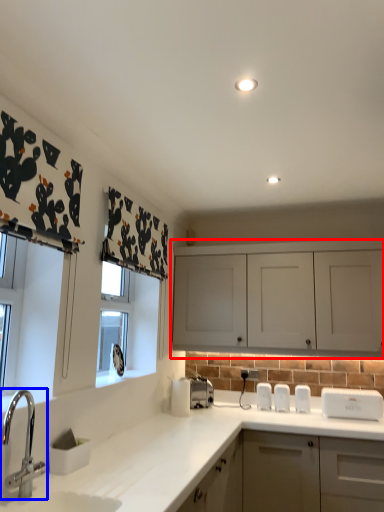
Question: Which of the following is the closest to the observer, cabinetry (highlighted by a red box) or tap (highlighted by a blue box)?

Choices:
 (A) cabinetry
 (B) tap

Answer: (B)